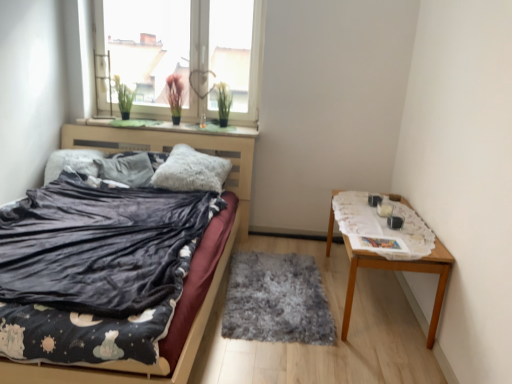
Locate an element on the screen. This screenshot has height=384, width=512. vacant space in between wooden table at right and fuzzy gray rug at center is located at coordinates (310, 256).